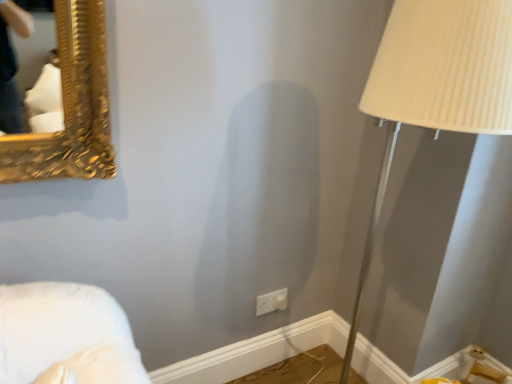
Question: Are white plastic electric outlet at lower center and beige ribbed shade at right far apart?

Choices:
 (A) yes
 (B) no

Answer: (A)

Question: From the image's perspective, is white plastic electric outlet at lower center above beige ribbed shade at right?

Choices:
 (A) no
 (B) yes

Answer: (A)

Question: Can you confirm if white plastic electric outlet at lower center is thinner than beige ribbed shade at right?

Choices:
 (A) no
 (B) yes

Answer: (B)

Question: Is white plastic electric outlet at lower center touching beige ribbed shade at right?

Choices:
 (A) no
 (B) yes

Answer: (A)

Question: Does white plastic electric outlet at lower center appear on the right side of beige ribbed shade at right?

Choices:
 (A) yes
 (B) no

Answer: (B)

Question: Does white plastic electric outlet at lower center have a lesser height compared to beige ribbed shade at right?

Choices:
 (A) no
 (B) yes

Answer: (B)

Question: Can you confirm if beige ribbed shade at right is thinner than white plastic electric outlet at lower center?

Choices:
 (A) no
 (B) yes

Answer: (A)

Question: From the image's perspective, is beige ribbed shade at right located above white plastic electric outlet at lower center?

Choices:
 (A) yes
 (B) no

Answer: (A)

Question: Is beige ribbed shade at right oriented away from white plastic electric outlet at lower center?

Choices:
 (A) yes
 (B) no

Answer: (B)

Question: Is beige ribbed shade at right surrounding white plastic electric outlet at lower center?

Choices:
 (A) no
 (B) yes

Answer: (A)

Question: Does beige ribbed shade at right have a greater height compared to white plastic electric outlet at lower center?

Choices:
 (A) yes
 (B) no

Answer: (A)

Question: Considering the relative sizes of beige ribbed shade at right and white plastic electric outlet at lower center in the image provided, is beige ribbed shade at right wider than white plastic electric outlet at lower center?

Choices:
 (A) no
 (B) yes

Answer: (B)

Question: Considering the positions of beige ribbed shade at right and white plastic electric outlet at lower center in the image, is beige ribbed shade at right wider or thinner than white plastic electric outlet at lower center?

Choices:
 (A) wide
 (B) thin

Answer: (A)